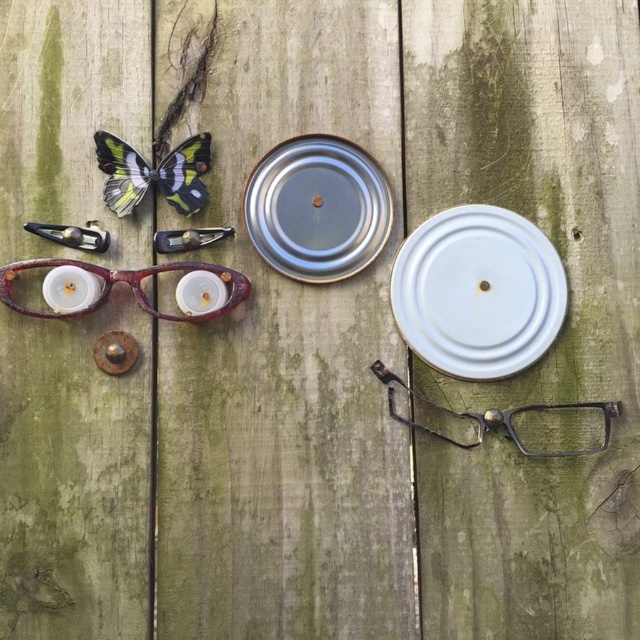
Question: Among these objects, which one is farthest from the camera?

Choices:
 (A) metallic silver plate at center
 (B) white matte plate at center
 (C) translucent plastic butterfly at upper left

Answer: (A)

Question: Which point is farther from the camera taking this photo?

Choices:
 (A) (182, 150)
 (B) (22, 308)
 (C) (332, 211)
 (D) (532, 326)

Answer: (C)

Question: Observing the image, what is the correct spatial positioning of metallic wire frame glasses at lower right in reference to wooden textured glasses at left?

Choices:
 (A) above
 (B) below

Answer: (B)

Question: Is metallic wire frame glasses at lower right below wooden textured glasses at left?

Choices:
 (A) yes
 (B) no

Answer: (A)

Question: From the image, what is the correct spatial relationship of metallic silver plate at center in relation to wooden textured glasses at left?

Choices:
 (A) below
 (B) above

Answer: (B)

Question: Which point is closer to the camera?

Choices:
 (A) (456, 364)
 (B) (122, 205)
 (C) (342, 218)
 (D) (545, 428)

Answer: (B)